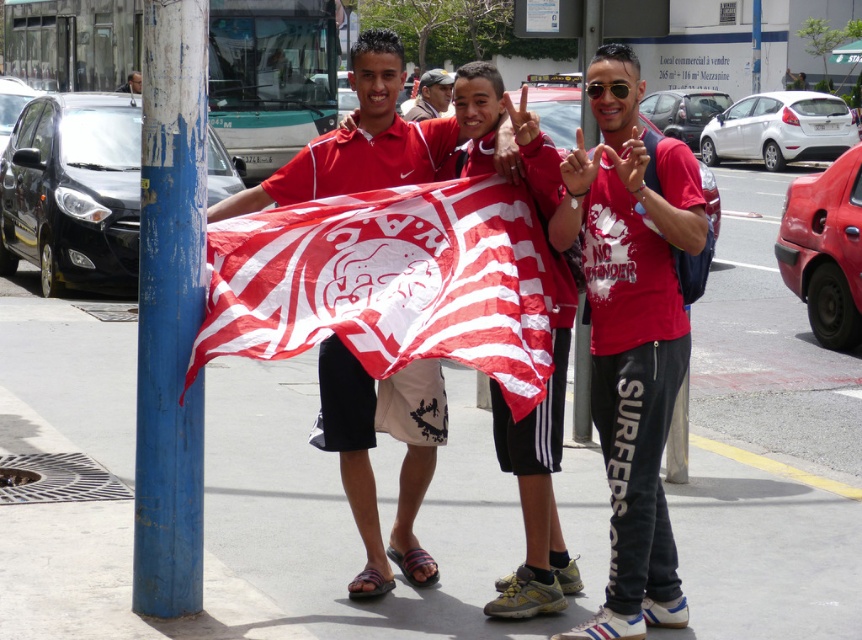
Who is positioned more to the right, matte red flag at center or matte black cap at center?

matte red flag at center

How far apart are matte red flag at center and matte black cap at center?

matte red flag at center and matte black cap at center are 6.25 meters apart from each other.

Between point (342, 387) and point (428, 109), which one is positioned behind?

The point (428, 109) is behind.

Where is `matte red flag at center`? matte red flag at center is located at coordinates (373, 445).

Which is above, matte red shirt at center or blue painted wood pole at left?

blue painted wood pole at left is above.

Can you confirm if matte red shirt at center is shorter than blue painted wood pole at left?

Yes.

In order to click on matte red shirt at center in this screenshot , I will do `click(631, 332)`.

Does blue painted wood pole at left lie behind matte black cap at center?

No.

Does point (172, 557) come behind point (425, 99)?

No.

Where is `blue painted wood pole at left`? This screenshot has width=862, height=640. blue painted wood pole at left is located at coordinates (170, 310).